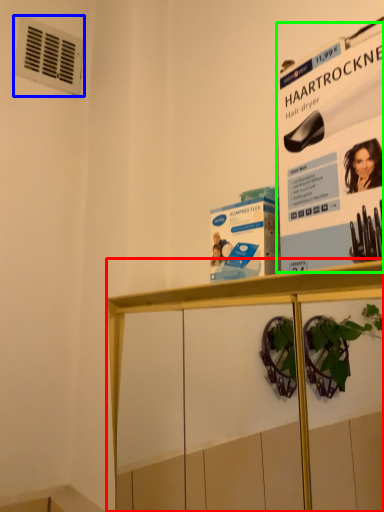
Question: Estimate the real-world distances between objects in this image. Which object is closer to shelf (highlighted by a red box), air conditioning (highlighted by a blue box) or poster page (highlighted by a green box)?

Choices:
 (A) air conditioning
 (B) poster page

Answer: (B)